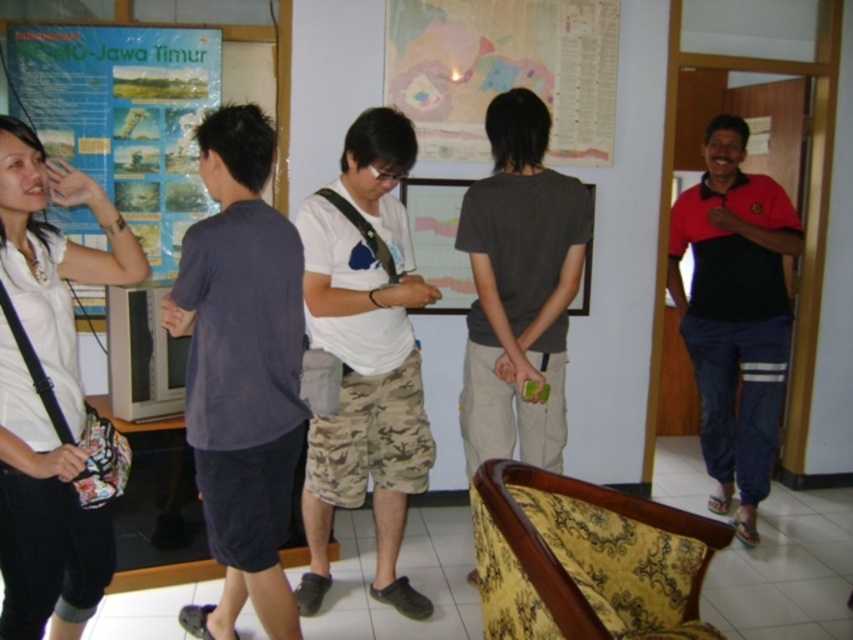
Question: Which of the following is the closest to the observer?

Choices:
 (A) matte paper poster at upper left
 (B) dark blue cotton t-shirt at center
 (C) matte gray shirt at center
 (D) black cotton shirt at right

Answer: (B)

Question: Which is nearer to the dark blue cotton t-shirt at center?

Choices:
 (A) black cotton shirt at right
 (B) white cotton shirt at center
 (C) matte gray shirt at center
 (D) white fabric purse at left

Answer: (D)

Question: Which of the following is the closest to the observer?

Choices:
 (A) (190, 348)
 (B) (610, 113)

Answer: (A)

Question: Observing the image, what is the correct spatial positioning of dark blue cotton t-shirt at center in reference to white cotton shirt at center?

Choices:
 (A) below
 (B) above

Answer: (A)

Question: Can you confirm if white cotton shirt at center is bigger than black cotton shirt at right?

Choices:
 (A) no
 (B) yes

Answer: (A)

Question: Is dark blue cotton t-shirt at center to the right of white fabric purse at left from the viewer's perspective?

Choices:
 (A) yes
 (B) no

Answer: (A)